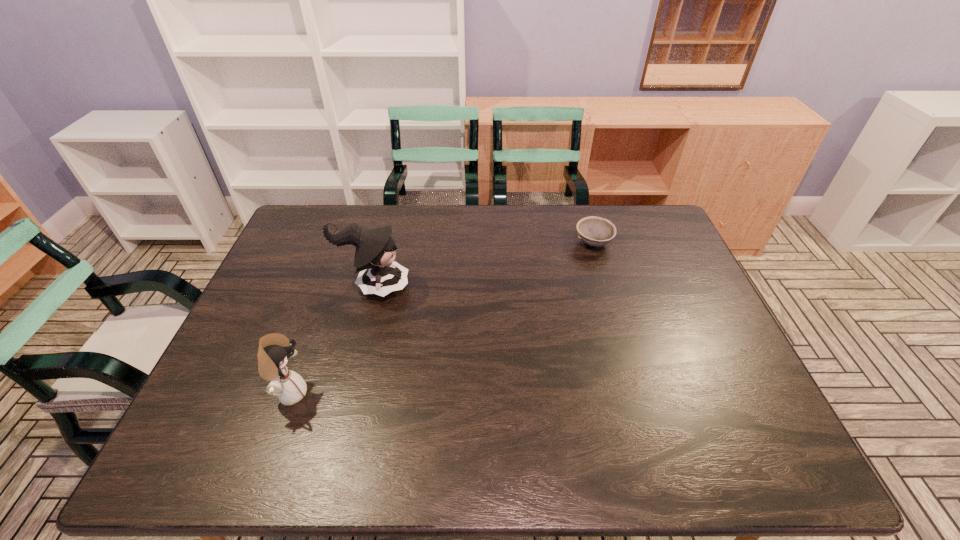
Locate an element on the screen. the farther doll is located at coordinates (378, 274).

At what (x,y) coordinates should I click in order to perform the action: click on the shorter doll. Please return your answer as a coordinate pair (x, y). This screenshot has height=540, width=960. Looking at the image, I should click on (274, 349).

You are a GUI agent. You are given a task and a screenshot of the screen. Output one action in this format:
    pyautogui.click(x=<x>, y=<y>)
    Task: Click on the second tallest object
    
    Given the screenshot: What is the action you would take?
    pyautogui.click(x=274, y=349)

In order to click on bowl in this screenshot , I will do `click(594, 231)`.

This screenshot has height=540, width=960. Identify the location of the shortest object. (594, 231).

This screenshot has width=960, height=540. In order to click on vacant space located 0.290m at the face of the second nearest object in this screenshot , I will do (507, 287).

Locate an element on the screen. free location located at the front face of the shorter doll is located at coordinates click(437, 393).

You are a GUI agent. You are given a task and a screenshot of the screen. Output one action in this format:
    pyautogui.click(x=<x>, y=<y>)
    Task: Click on the free space located 0.150m on the right of the rightmost object
    The image size is (960, 540).
    Given the screenshot: What is the action you would take?
    pyautogui.click(x=658, y=243)

Where is `object present at the far edge`? Image resolution: width=960 pixels, height=540 pixels. object present at the far edge is located at coordinates (594, 231).

You are a GUI agent. You are given a task and a screenshot of the screen. Output one action in this format:
    pyautogui.click(x=<x>, y=<y>)
    Task: Click on the object positioned at the left edge
    
    Given the screenshot: What is the action you would take?
    pyautogui.click(x=274, y=349)